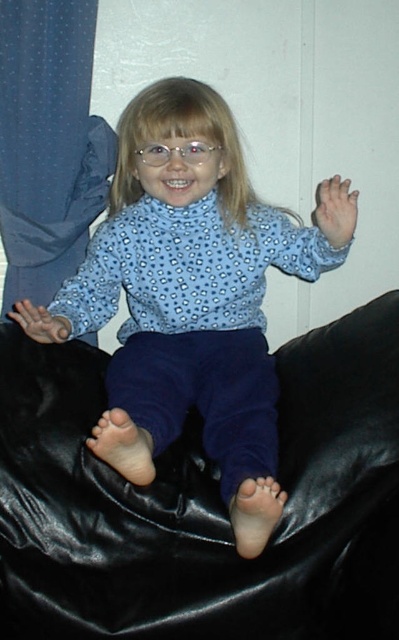
You are a fashion designer observing the image. You need to decide which item is taller between the blue dotted shirt at center and the clear plastic glasses at center. Which one is taller?

The blue dotted shirt at center is taller than the clear plastic glasses at center according to the description.

You are a photographer setting up a shoot in the room described. You want to place a large lamp between the black leather bean bag chair at center and the blue fabric curtain at left. Based on their positions, which side of the curtain should the lamp be placed?

The black leather bean bag chair at center is positioned on the right side of the blue fabric curtain at left, so the lamp should be placed to the right of the blue fabric curtain at left.

You are standing in the room where the black leather bean bag chair at center is located. If you want to place a small decorative pillow exactly where the chair is positioned, where should you place it?

You should place the small decorative pillow at the 2D location point of the black leather bean bag chair at center, which is at point (203, 502).